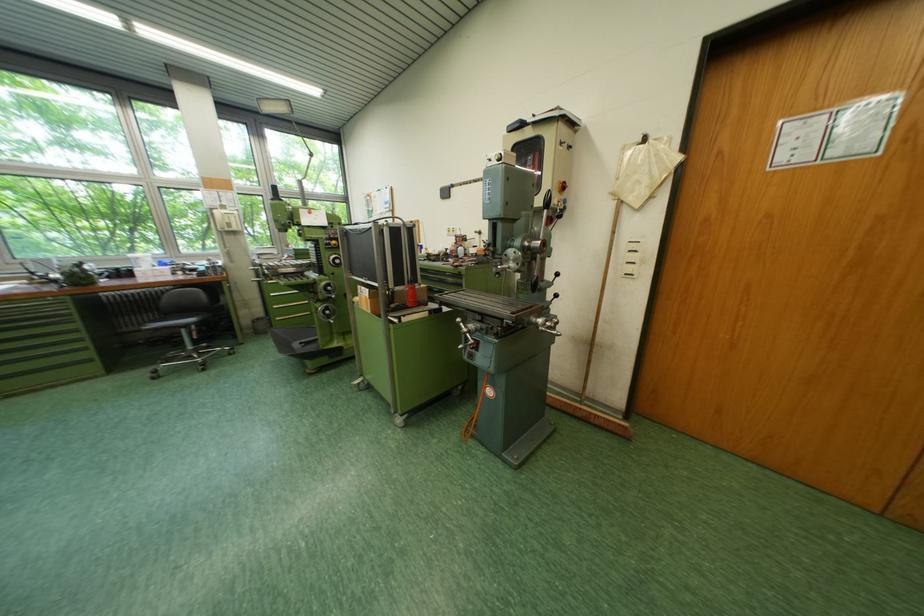
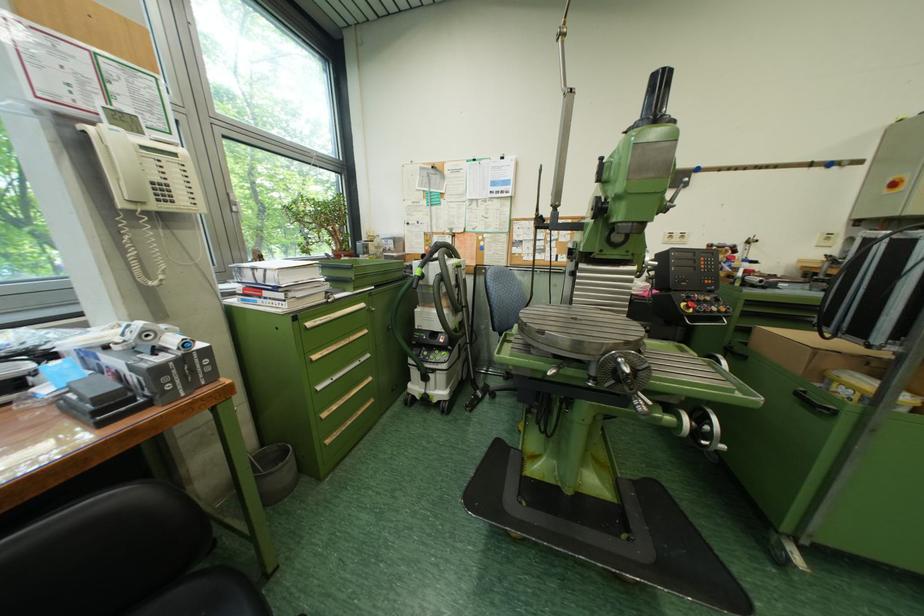
In the scene shown: In a continuous first-person perspective shot, in which direction is the camera moving?

The cameraman moved toward left, forward.